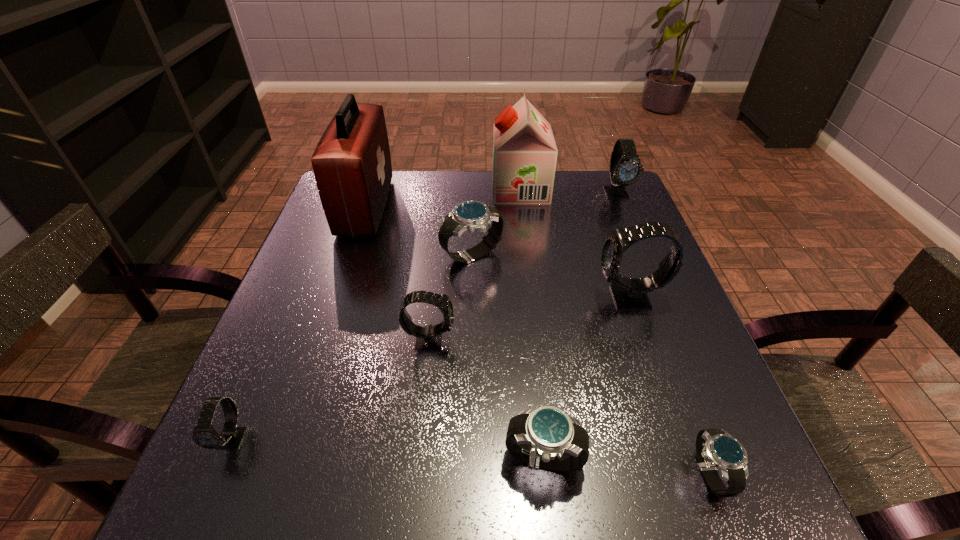
You are a GUI agent. You are given a task and a screenshot of the screen. Output one action in this format:
    pyautogui.click(x=<x>, y=<y>)
    Task: Click on the soya milk at the far edge
    The width and height of the screenshot is (960, 540).
    Given the screenshot: What is the action you would take?
    click(524, 150)

I want to click on watch at the far edge, so click(625, 169).

Find the location of a particular element. The height and width of the screenshot is (540, 960). the first aid kit present at the left edge is located at coordinates (352, 166).

Where is `watch located in the left edge section of the desktop`? This screenshot has width=960, height=540. watch located in the left edge section of the desktop is located at coordinates [204, 435].

What are the coordinates of `object that is at the far left corner` in the screenshot? It's located at (352, 166).

The height and width of the screenshot is (540, 960). What are the coordinates of `object at the near left corner` in the screenshot? It's located at (204, 435).

You are a GUI agent. You are given a task and a screenshot of the screen. Output one action in this format:
    pyautogui.click(x=<x>, y=<y>)
    Task: Click on the object at the far right corner
    
    Given the screenshot: What is the action you would take?
    pyautogui.click(x=625, y=169)

You are a GUI agent. You are given a task and a screenshot of the screen. Output one action in this format:
    pyautogui.click(x=<x>, y=<y>)
    Task: Click on the object located in the near right corner section of the desktop
    This screenshot has width=960, height=540.
    Given the screenshot: What is the action you would take?
    pyautogui.click(x=715, y=448)

In the image, there is a desktop. What are the coordinates of `vacant region at the far edge` in the screenshot? It's located at (481, 199).

Locate an element on the screen. The height and width of the screenshot is (540, 960). vacant space at the near edge of the desktop is located at coordinates (339, 521).